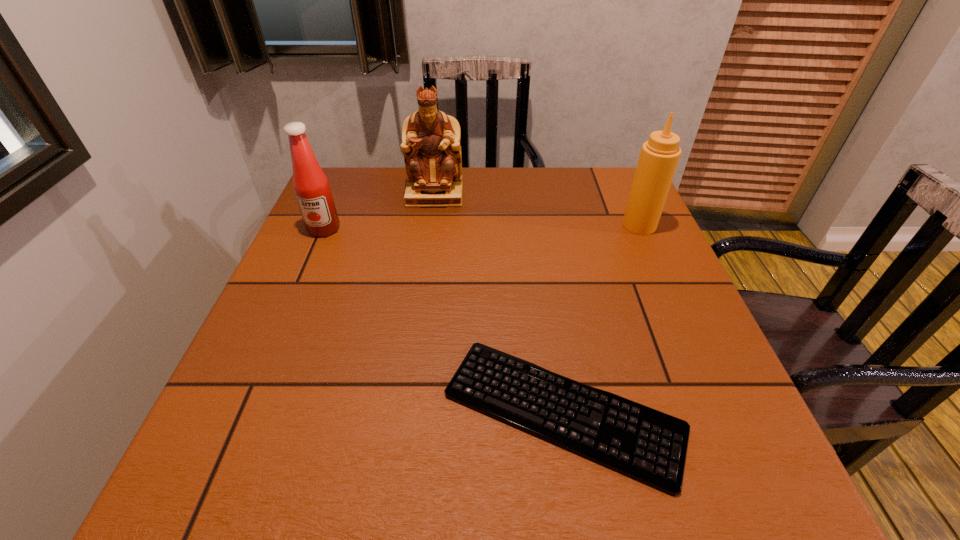
The width and height of the screenshot is (960, 540). I want to click on object that is at the near edge, so click(645, 444).

Locate an element on the screen. object located at the left edge is located at coordinates (312, 190).

Where is `condiment that is positioned at the right edge`? The image size is (960, 540). condiment that is positioned at the right edge is located at coordinates (659, 156).

The width and height of the screenshot is (960, 540). I want to click on computer keyboard located at the right edge, so click(x=645, y=444).

This screenshot has width=960, height=540. I want to click on object located at the near right corner, so click(x=645, y=444).

What are the coordinates of `vacant space at the far edge of the desktop` in the screenshot? It's located at (488, 186).

Identify the location of free point at the near edge. This screenshot has width=960, height=540. (332, 497).

I want to click on vacant region at the left edge of the desktop, so click(355, 230).

The image size is (960, 540). I want to click on free region at the right edge of the desktop, so click(x=708, y=362).

You are a GUI agent. You are given a task and a screenshot of the screen. Output one action in this format:
    pyautogui.click(x=<x>, y=<y>)
    Task: Click on the free space at the far left corner
    
    Given the screenshot: What is the action you would take?
    pyautogui.click(x=339, y=167)